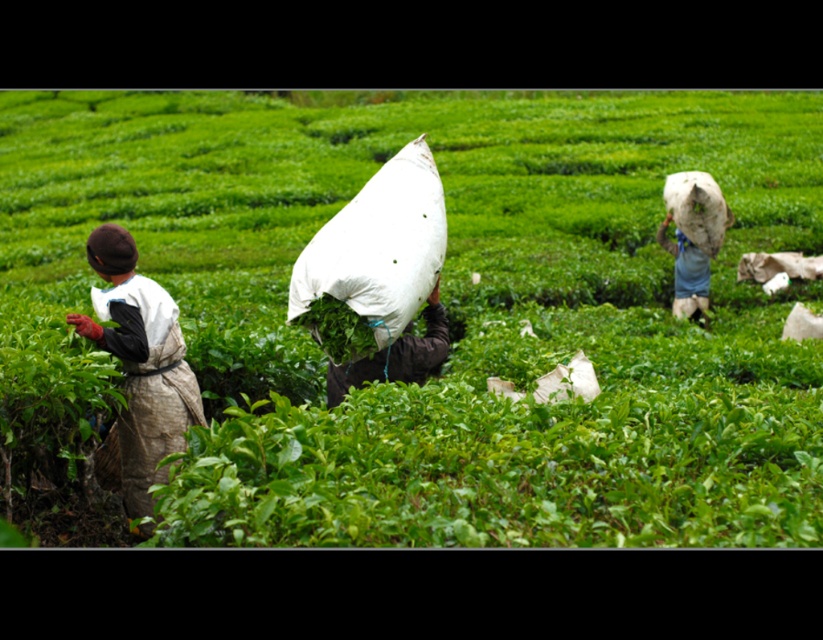
Is brown fabric apron at left shorter than white fabric sack at center?

In fact, brown fabric apron at left may be taller than white fabric sack at center.

Can you confirm if brown fabric apron at left is positioned to the left of white fabric sack at center?

Indeed, brown fabric apron at left is positioned on the left side of white fabric sack at center.

Is point (180, 362) in front of point (414, 340)?

No.

Find the location of a particular element. The image size is (823, 640). brown fabric apron at left is located at coordinates (140, 364).

Is white fabric bag at center thinner than white fabric bag at upper right?

No, white fabric bag at center is not thinner than white fabric bag at upper right.

From the picture: Is white fabric bag at center wider than white fabric bag at upper right?

Indeed, white fabric bag at center has a greater width compared to white fabric bag at upper right.

Image resolution: width=823 pixels, height=640 pixels. Find the location of `white fabric bag at center`. white fabric bag at center is located at coordinates [x=373, y=259].

The width and height of the screenshot is (823, 640). What do you see at coordinates (452, 310) in the screenshot?
I see `green fabric bag at center` at bounding box center [452, 310].

Does point (289, 509) come in front of point (338, 401)?

Yes, it is in front of point (338, 401).

What do you see at coordinates (452, 310) in the screenshot? I see `green fabric bag at center` at bounding box center [452, 310].

Where is `green fabric bag at center`? This screenshot has width=823, height=640. green fabric bag at center is located at coordinates (452, 310).